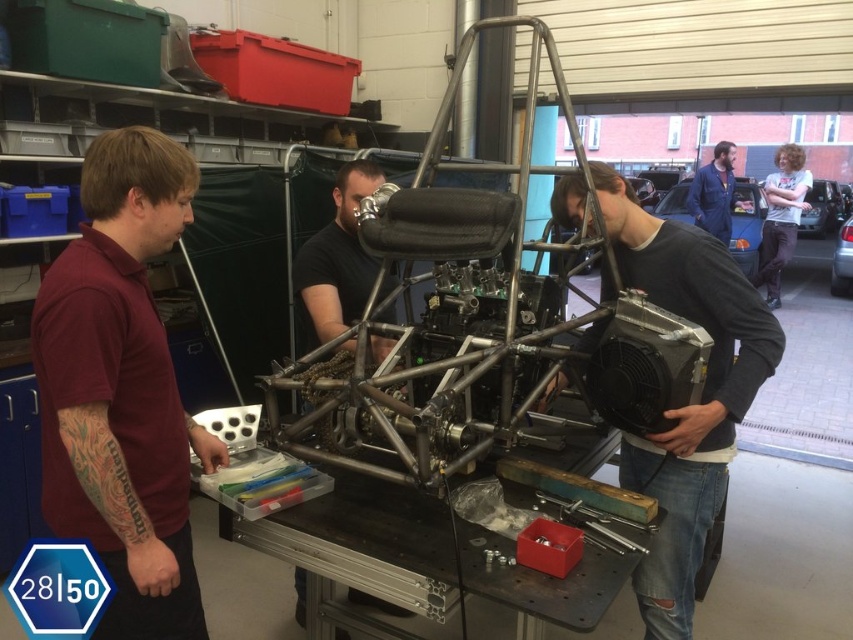
Based on the photo, you are a visitor in the workshop and want to locate the person wearing the maroon shirt at left. Based on their position relative to the black matte helmet at center, where should you look?

The maroon shirt at left is located below the black matte helmet at center, so you should look downward from the black matte helmet at center to find the maroon shirt at left.

You are a safety inspector in the workshop and need to ensure that the maroon shirt at left and the black matte helmet at center are within a 1 meter safety distance. Based on the scene description, can you confirm if they are within the required distance?

The maroon shirt at left is 79.44 centimeters away from the black matte helmet at center, which is within the 1 meter safety distance requirement. Therefore, they are within the required distance.

You are a visitor in the workshop and want to greet both the person in the maroon shirt at left and the person in the blue denim jacket at upper right. If you start from the entrance door located at the lower left corner of the workshop, which person should you approach first based on their positions?

The maroon shirt at left is positioned under the blue denim jacket at upper right, so you should approach the maroon shirt at left first since it is closer to your starting position at the lower left corner.